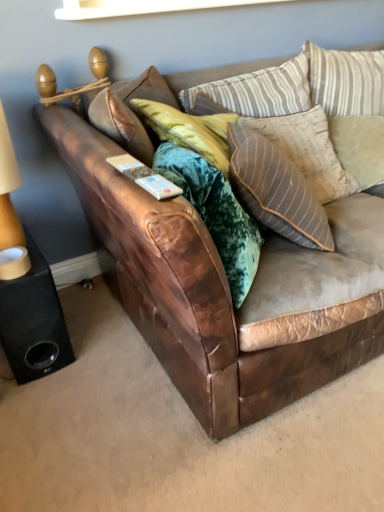
Question: Can you confirm if striped fabric pillow at upper right, placed as the 2th pillow when sorted from right to left, is taller than striped fabric pillow at upper center, placed as the 1th pillow when sorted from left to right?

Choices:
 (A) yes
 (B) no

Answer: (A)

Question: Is striped fabric pillow at upper right, the 2th pillow in the left-to-right sequence, positioned before striped fabric pillow at upper center, the third pillow when ordered from right to left?

Choices:
 (A) no
 (B) yes

Answer: (B)

Question: Is striped fabric pillow at upper right, the 2th pillow in the left-to-right sequence, positioned far away from striped fabric pillow at upper center, placed as the 1th pillow when sorted from left to right?

Choices:
 (A) no
 (B) yes

Answer: (A)

Question: Is striped fabric pillow at upper right, the 2th pillow in the left-to-right sequence, turned away from striped fabric pillow at upper center, placed as the 1th pillow when sorted from left to right?

Choices:
 (A) no
 (B) yes

Answer: (B)

Question: From the image's perspective, is striped fabric pillow at upper right, the 2th pillow in the left-to-right sequence, on striped fabric pillow at upper center, the third pillow when ordered from right to left?

Choices:
 (A) yes
 (B) no

Answer: (B)

Question: Considering the relative positions of striped fabric pillow at upper right, the 2th pillow in the left-to-right sequence, and striped fabric pillow at upper center, placed as the 1th pillow when sorted from left to right, in the image provided, is striped fabric pillow at upper right, the 2th pillow in the left-to-right sequence, to the right of striped fabric pillow at upper center, placed as the 1th pillow when sorted from left to right, from the viewer's perspective?

Choices:
 (A) no
 (B) yes

Answer: (B)

Question: Could you tell me if black matte speaker at lower left is facing striped fabric pillow at upper center, the third pillow when ordered from right to left?

Choices:
 (A) yes
 (B) no

Answer: (B)

Question: Considering the relative sizes of black matte speaker at lower left and striped fabric pillow at upper center, the third pillow when ordered from right to left, in the image provided, is black matte speaker at lower left thinner than striped fabric pillow at upper center, the third pillow when ordered from right to left,?

Choices:
 (A) no
 (B) yes

Answer: (A)

Question: Does black matte speaker at lower left appear on the right side of striped fabric pillow at upper center, the third pillow when ordered from right to left?

Choices:
 (A) no
 (B) yes

Answer: (A)

Question: Is black matte speaker at lower left at the left side of striped fabric pillow at upper center, placed as the 1th pillow when sorted from left to right?

Choices:
 (A) yes
 (B) no

Answer: (A)

Question: Can you confirm if black matte speaker at lower left is wider than striped fabric pillow at upper center, placed as the 1th pillow when sorted from left to right?

Choices:
 (A) yes
 (B) no

Answer: (A)

Question: Is black matte speaker at lower left far away from striped fabric pillow at upper center, the third pillow when ordered from right to left?

Choices:
 (A) yes
 (B) no

Answer: (B)

Question: Is beige textured pillow at upper right, arranged as the 1th pillow when viewed from the right, facing towards black matte speaker at lower left?

Choices:
 (A) yes
 (B) no

Answer: (B)